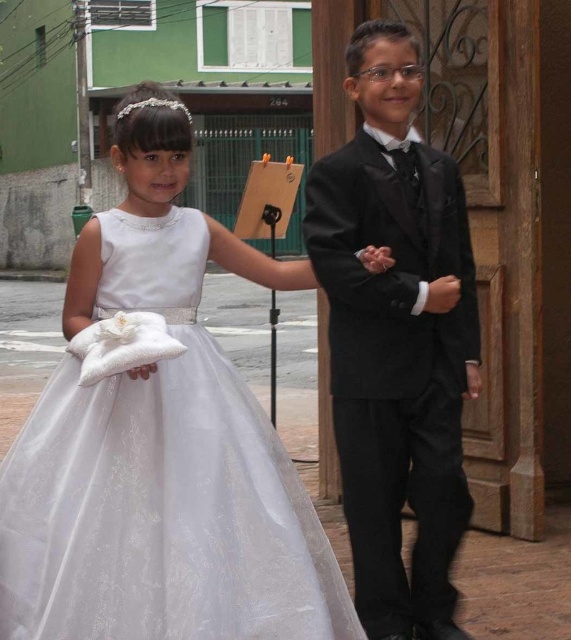
You are a photographer standing 3 meters away from the white satin dress at center. Can you adjust your position to get a closer shot without moving the dress? Explain why or why not based on the given information.

The white satin dress at center is 2.91 meters away from the viewer. Since you are already standing 3 meters away, which is slightly farther than the dress, you can move closer by approximately 9 centimeters to get a closer shot without moving the dress.

You are a photographer setting up for a photo shoot with two children wearing formal attire. The scene includes a white satin dress at center and a black satin suit at center. To ensure both children are framed properly, which clothing item should you adjust first if you want to balance their sizes in the photo?

The white satin dress at center is larger than the black satin suit at center. To balance their sizes, adjust the position of the white satin dress at center, perhaps moving it closer to the camera to make it appear smaller, or the black satin suit at center further away to make it appear larger.